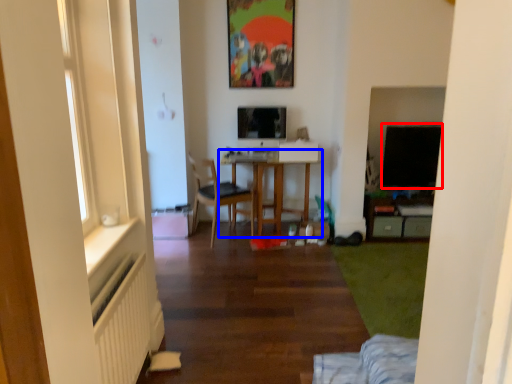
Question: Which object is closer to the camera taking this photo, window screen (highlighted by a red box) or table (highlighted by a blue box)?

Choices:
 (A) window screen
 (B) table

Answer: (B)